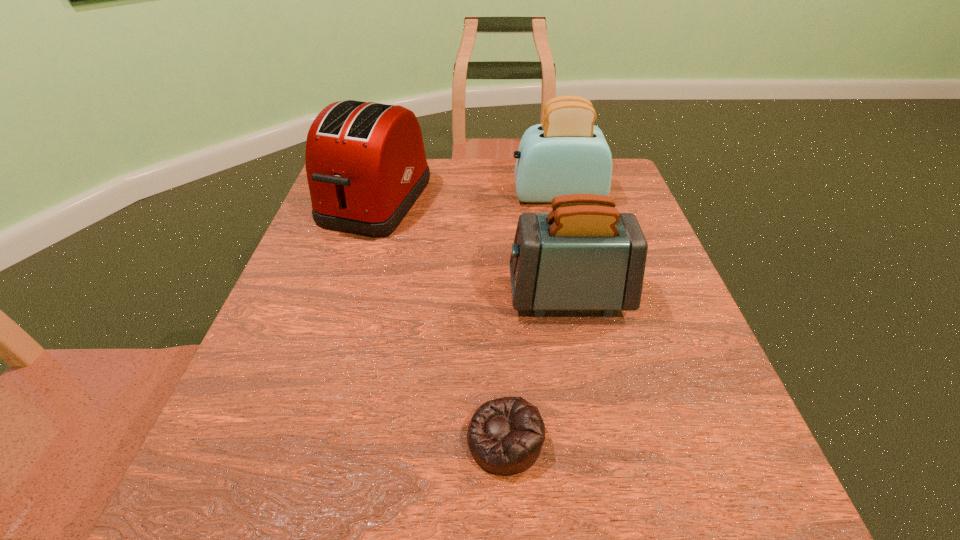
What are the coordinates of `object located in the left edge section of the desktop` in the screenshot? It's located at (366, 166).

Image resolution: width=960 pixels, height=540 pixels. Identify the location of object situated at the far left corner. (366, 166).

Where is `object present at the far right corner`? The height and width of the screenshot is (540, 960). object present at the far right corner is located at coordinates (567, 154).

Where is `vacant point at the far edge`? This screenshot has height=540, width=960. vacant point at the far edge is located at coordinates (476, 183).

At what (x,y) coordinates should I click in order to perform the action: click on free region at the right edge. Please return your answer as a coordinate pair (x, y). Looking at the image, I should click on (699, 430).

In the image, there is a desktop. Where is `free space at the far right corner`? The width and height of the screenshot is (960, 540). free space at the far right corner is located at coordinates (612, 167).

In the image, there is a desktop. In order to click on vacant space at the near right corner in this screenshot , I will do `click(673, 511)`.

The width and height of the screenshot is (960, 540). Find the location of `free area in between the leftmost toaster and the shortest object`. free area in between the leftmost toaster and the shortest object is located at coordinates (441, 320).

The height and width of the screenshot is (540, 960). In order to click on vacant area that lies between the leftmost toaster and the shortest object in this screenshot , I will do `click(441, 320)`.

The width and height of the screenshot is (960, 540). What are the coordinates of `vacant space that is in between the nearest object and the leftmost object` in the screenshot? It's located at (441, 320).